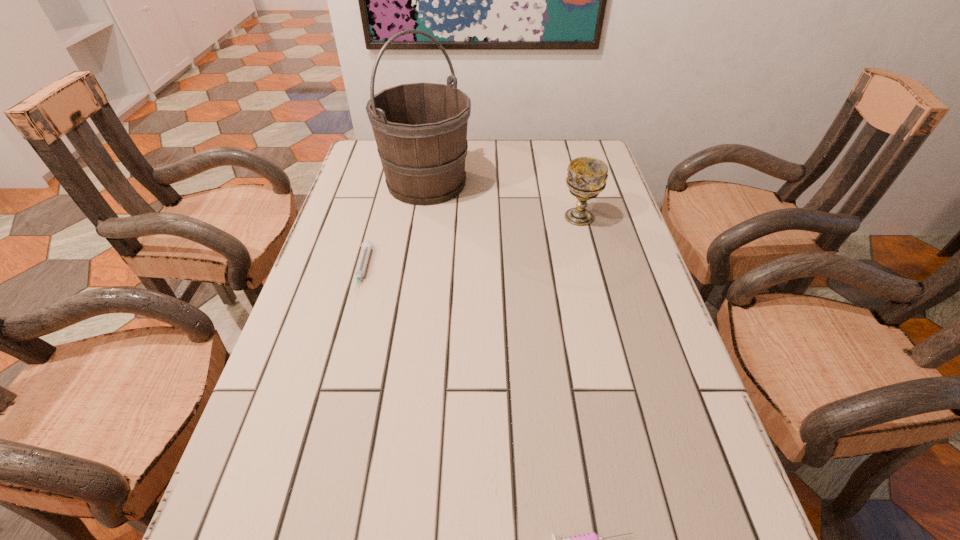
Where is `object that ranks as the third closest to the nearer syringe`? The image size is (960, 540). object that ranks as the third closest to the nearer syringe is located at coordinates (420, 129).

Locate an element on the screen. The height and width of the screenshot is (540, 960). free spot that satisfies the following two spatial constraints: 1. on the front side of the tallest object; 2. on the left side of the chalice is located at coordinates (421, 217).